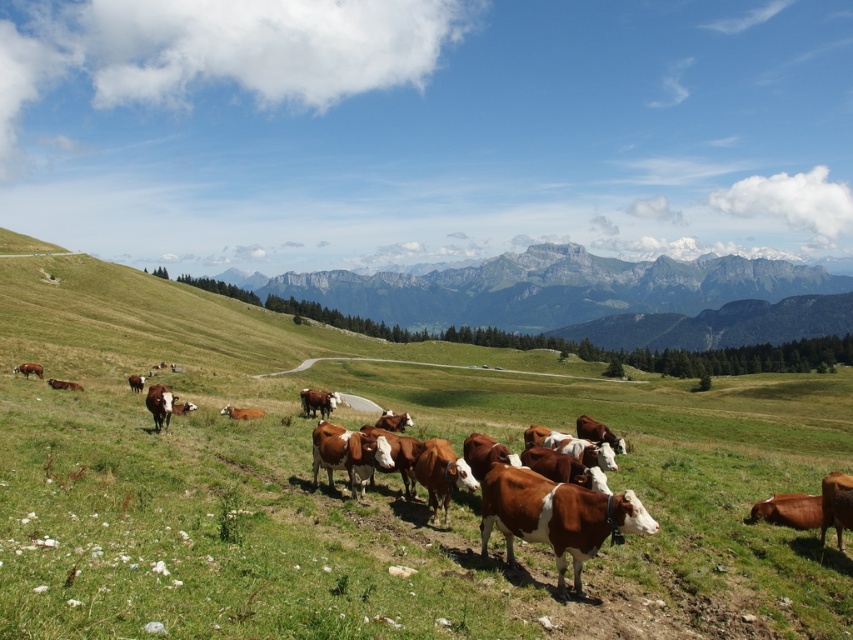
Question: Can you confirm if green grassy field at center is positioned to the right of green grassy mountain range at upper center?

Choices:
 (A) yes
 (B) no

Answer: (B)

Question: Among these objects, which one is nearest to the camera?

Choices:
 (A) green grassy field at center
 (B) green grassy mountain range at upper center

Answer: (A)

Question: Does green grassy field at center have a greater width compared to green grassy mountain range at upper center?

Choices:
 (A) no
 (B) yes

Answer: (A)

Question: Considering the relative positions of green grassy field at center and green grassy mountain range at upper center in the image provided, where is green grassy field at center located with respect to green grassy mountain range at upper center?

Choices:
 (A) below
 (B) above

Answer: (A)